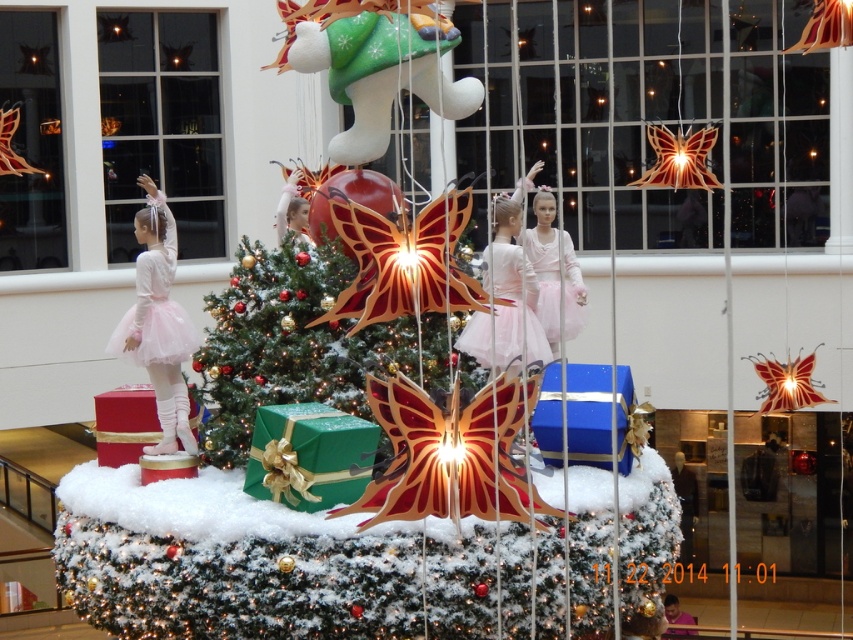
Is the position of pink satin tutu at center less distant than that of pink satin doll at center?

Yes.

Who is taller, pink satin tutu at center or pink satin doll at center?

Standing taller between the two is pink satin tutu at center.

Image resolution: width=853 pixels, height=640 pixels. Find the location of `pink satin tutu at center`. pink satin tutu at center is located at coordinates (506, 298).

Does point (300, 291) come farther from viewer compared to point (523, 262)?

No.

What do you see at coordinates (286, 342) in the screenshot?
I see `green paper christmas tree at center` at bounding box center [286, 342].

Where is `green paper christmas tree at center`? green paper christmas tree at center is located at coordinates (286, 342).

Between pink tulle ballet dancer at upper left and pink satin doll at center, which one has less height?

Standing shorter between the two is pink satin doll at center.

Looking at this image, can you confirm if pink tulle ballet dancer at upper left is shorter than pink satin doll at center?

No.

Is point (173, 193) farther from viewer compared to point (550, 234)?

Yes, point (173, 193) is farther from viewer.

At what (x,y) coordinates should I click in order to perform the action: click on pink tulle ballet dancer at upper left. Please return your answer as a coordinate pair (x, y). The height and width of the screenshot is (640, 853). Looking at the image, I should click on (161, 124).